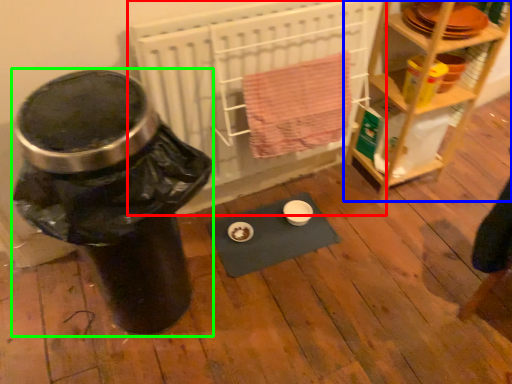
Question: Which is farther away from wide (highlighted by a red box)? furniture (highlighted by a blue box) or water cooler (highlighted by a green box)?

Choices:
 (A) furniture
 (B) water cooler

Answer: (B)